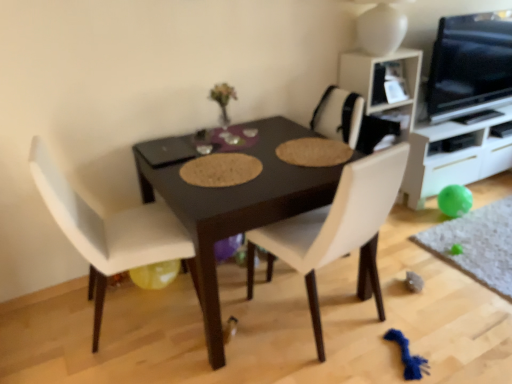
The image size is (512, 384). I want to click on vacant space positioned to the left of green rubber ball at lower right, so click(413, 270).